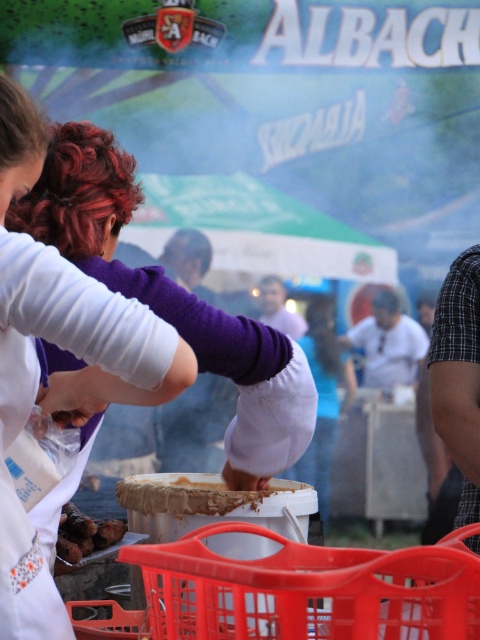
Between purple matte sweater at center and white matte bowl at center, which one appears on the right side from the viewer's perspective?

Positioned to the right is white matte bowl at center.

Consider the image. Can you confirm if purple matte sweater at center is shorter than white matte bowl at center?

In fact, purple matte sweater at center may be taller than white matte bowl at center.

Locate an element on the screen. Image resolution: width=480 pixels, height=640 pixels. purple matte sweater at center is located at coordinates (63, 372).

Does point (3, 125) come in front of point (379, 298)?

Yes, it is.

Can you confirm if purple matte sweater at center is wider than white cotton shirt at center?

No, purple matte sweater at center is not wider than white cotton shirt at center.

This screenshot has width=480, height=640. Identify the location of purple matte sweater at center. (63, 372).

Locate an element on the screen. Image resolution: width=480 pixels, height=640 pixels. purple matte sweater at center is located at coordinates (63, 372).

This screenshot has height=640, width=480. Find the location of `white cotton shirt at center`. white cotton shirt at center is located at coordinates (387, 342).

Can you confirm if white cotton shirt at center is taller than brown matte skewers at lower left?

Indeed, white cotton shirt at center has a greater height compared to brown matte skewers at lower left.

Is point (412, 344) closer to viewer compared to point (59, 532)?

That is False.

The image size is (480, 640). I want to click on white cotton shirt at center, so click(x=387, y=342).